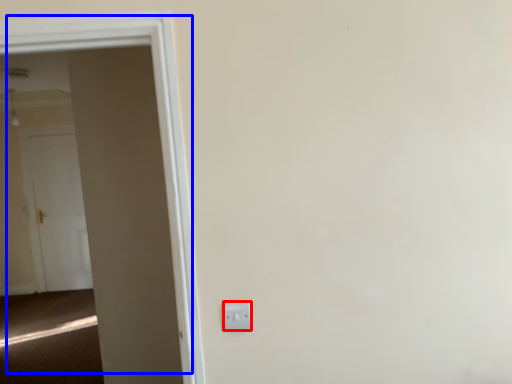
Question: Among these objects, which one is farthest to the camera, electric outlet (highlighted by a red box) or door (highlighted by a blue box)?

Choices:
 (A) electric outlet
 (B) door

Answer: (A)